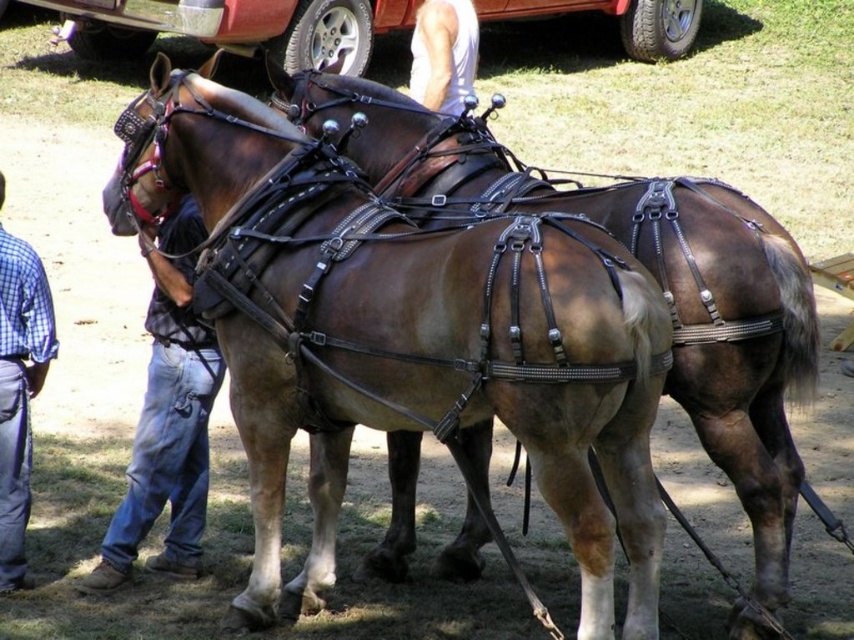
You are a photographer setting up a shot of the two draft horses. You notice the brushed metal car at upper center and the blue jeans at left in the background. Which object is closer to the camera?

The brushed metal car at upper center is closer to the camera because it is positioned over the blue jeans at left, indicating it is in front of them.

You are a photographer at the event and want to capture both the blue plaid shirt at left and the white tank top at upper center in a single frame. Which clothing item should you focus on first to ensure both are in the frame?

You should focus on the blue plaid shirt at left first because it is narrower than the white tank top at upper center, allowing more room to include both in the frame.

You are a photographer trying to capture both the brushed metal car at upper center and the white tank top at upper center in a single frame. Based on their positions, which object should you focus on first to ensure both are in focus?

The brushed metal car at upper center is located above the white tank top at upper center, so focusing on the white tank top at upper center first will help ensure both are in focus since it is closer to the camera.